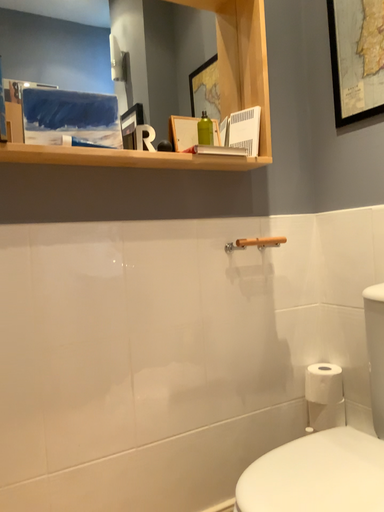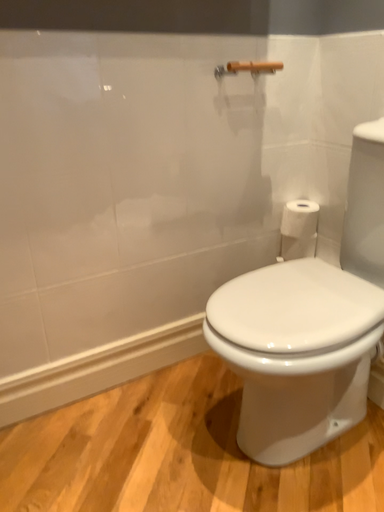
Question: Which way did the camera rotate in the video?

Choices:
 (A) rotated downward
 (B) rotated upward

Answer: (A)